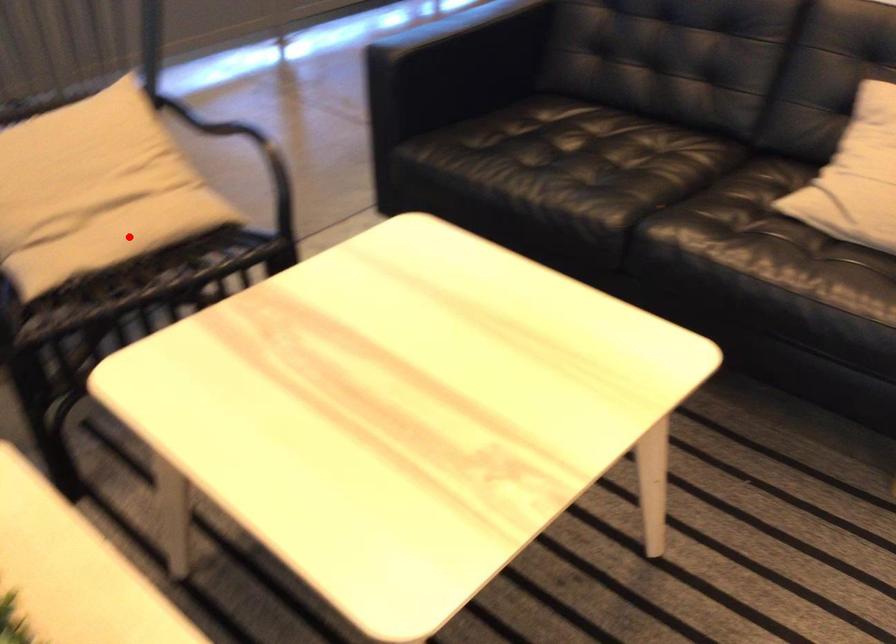
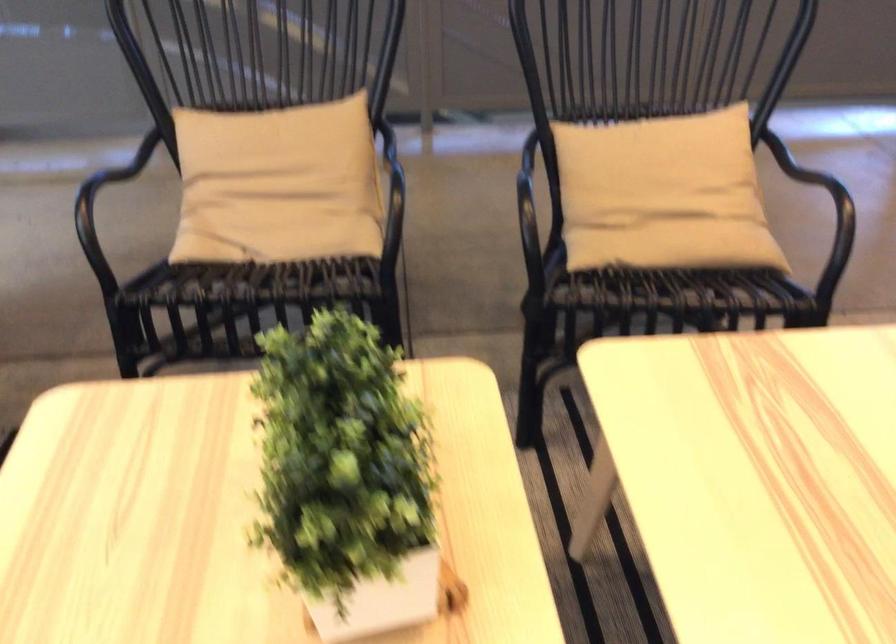
The point at the highlighted location is marked in the first image. Where is the corresponding point in the second image?

(674, 245)